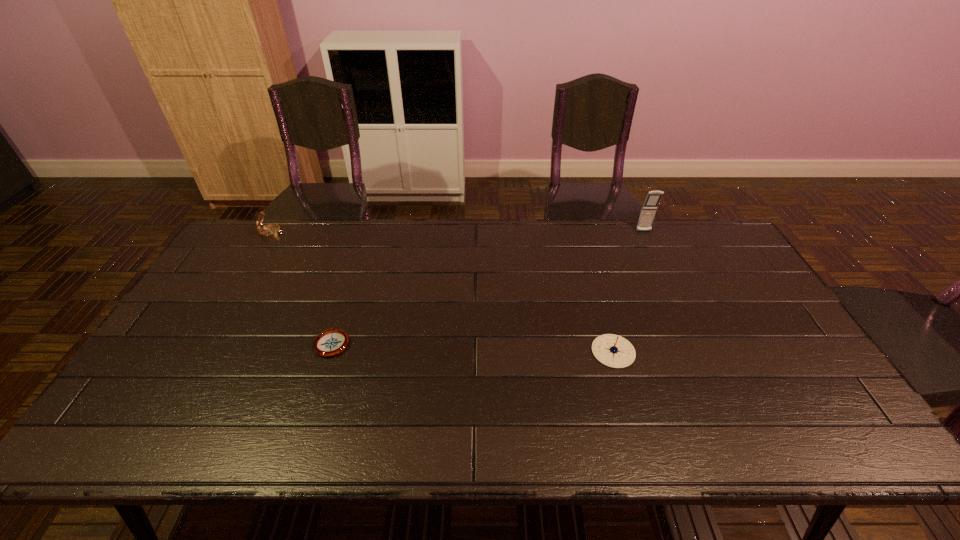
The image size is (960, 540). In order to click on the tallest object in this screenshot , I will do `click(649, 208)`.

You are a GUI agent. You are given a task and a screenshot of the screen. Output one action in this format:
    pyautogui.click(x=<x>, y=<y>)
    Task: Click on the cellular telephone
    
    Given the screenshot: What is the action you would take?
    pyautogui.click(x=649, y=208)

Image resolution: width=960 pixels, height=540 pixels. In order to click on the leftmost compass in this screenshot , I will do `click(269, 231)`.

What are the coordinates of `the third shortest object` in the screenshot? It's located at (269, 231).

You are a GUI agent. You are given a task and a screenshot of the screen. Output one action in this format:
    pyautogui.click(x=<x>, y=<y>)
    Task: Click on the second tallest compass
    
    Given the screenshot: What is the action you would take?
    pyautogui.click(x=614, y=351)

Locate an element on the screen. This screenshot has height=540, width=960. the second shortest object is located at coordinates (614, 351).

At what (x,y) coordinates should I click in order to perform the action: click on the shortest object. Please return your answer as a coordinate pair (x, y). This screenshot has height=540, width=960. Looking at the image, I should click on (331, 342).

Locate an element on the screen. This screenshot has height=540, width=960. the second compass from right to left is located at coordinates (331, 342).

At what (x,y) coordinates should I click in order to perform the action: click on vacant space located on the front-facing side of the tallest object. Please return your answer as a coordinate pair (x, y). The height and width of the screenshot is (540, 960). Looking at the image, I should click on (661, 271).

The height and width of the screenshot is (540, 960). In order to click on free space located with the dial facing the leftmost object in this screenshot , I will do `click(369, 233)`.